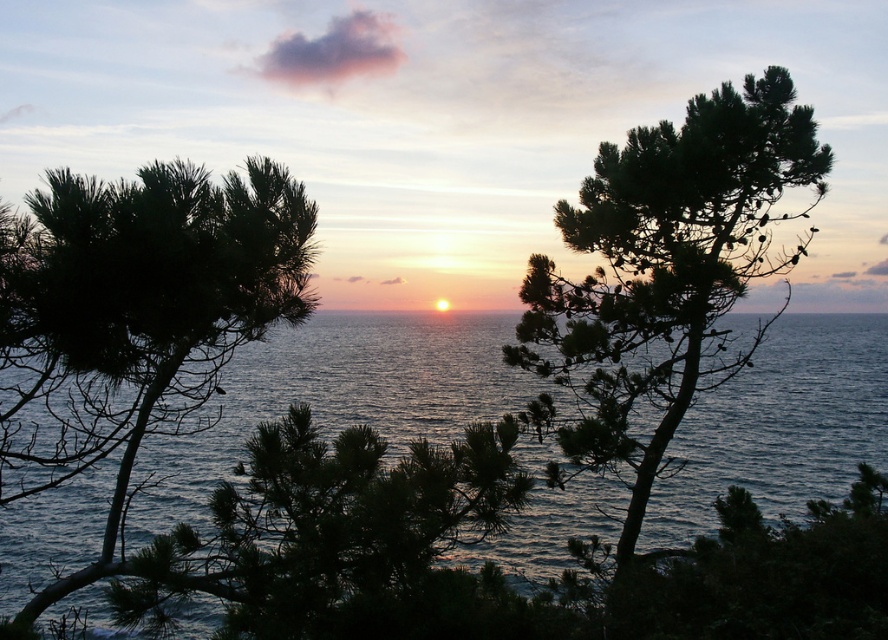
Describe the element at coordinates (339, 397) in the screenshot. This screenshot has height=640, width=888. I see `blue water at center` at that location.

Is point (789, 412) less distant than point (115, 275)?

No.

Is point (12, 576) farther from camera compared to point (235, 243)?

That is True.

You are a GUI agent. You are given a task and a screenshot of the screen. Output one action in this format:
    pyautogui.click(x=<x>, y=<y>)
    Task: Click on the blue water at center
    This screenshot has height=640, width=888.
    Given the screenshot: What is the action you would take?
    pyautogui.click(x=339, y=397)

Between point (216, 336) and point (687, 138), which one is positioned in front?

Positioned in front is point (216, 336).

Is point (42, 396) positioned behind point (627, 419)?

No, (42, 396) is in front of (627, 419).

This screenshot has width=888, height=640. What are the coordinates of `dark green pine tree at left` in the screenshot? It's located at (135, 317).

Who is positioned more to the right, blue water at center or dark green pine tree at center?

From the viewer's perspective, blue water at center appears more on the right side.

Between blue water at center and dark green pine tree at center, which one appears on the left side from the viewer's perspective?

dark green pine tree at center

This screenshot has height=640, width=888. What are the coordinates of `blue water at center` in the screenshot? It's located at (339, 397).

The width and height of the screenshot is (888, 640). What are the coordinates of `blue water at center` in the screenshot? It's located at (339, 397).